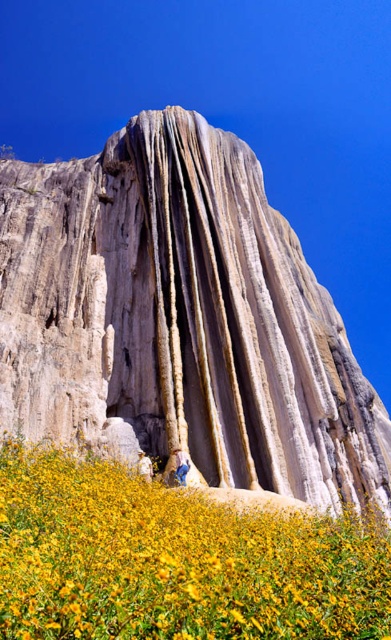
You are a geologist examining the natural formation. You notice the white textured rock at center and the yellow matte flower at lower center. Which object is located higher in the scene?

The white textured rock at center is positioned over the yellow matte flower at lower center, so it is higher in the scene.

You are a geologist examining the scene. You need to determine which object occupies more space in the image. Which is larger in size between the white textured rock at center and the yellow matte flower at lower center?

The white textured rock at center is larger in size than the yellow matte flower at lower center according to the description.

You are a geologist examining the white textured rock at center and the yellow matte flower at lower center. Which object is closer to your current position?

The white textured rock at center is closer to you than the yellow matte flower at lower center because it is further to the viewer.